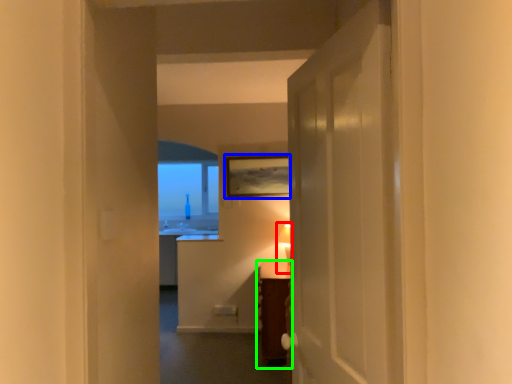
Question: Which object is positioned farthest from table lamp (highlighted by a red box)? Select from picture frame (highlighted by a blue box) and furniture (highlighted by a green box).

Choices:
 (A) picture frame
 (B) furniture

Answer: (B)